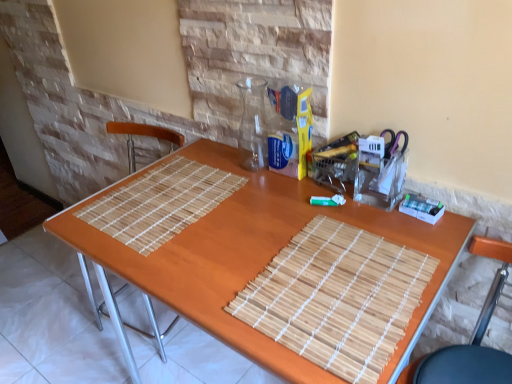
This screenshot has height=384, width=512. I want to click on wooden table at center, so click(x=257, y=256).

Looking at this image, what is the approximate width of wooden table at center?

23.62 inches.

What do you see at coordinates (257, 256) in the screenshot? This screenshot has height=384, width=512. I see `wooden table at center` at bounding box center [257, 256].

The height and width of the screenshot is (384, 512). What do you see at coordinates (472, 336) in the screenshot?
I see `wooden chair at lower right` at bounding box center [472, 336].

Image resolution: width=512 pixels, height=384 pixels. I want to click on wooden chair at lower right, so click(472, 336).

What is the approximate width of wooden chair at lower right?

17.75 inches.

This screenshot has height=384, width=512. I want to click on wooden table at center, so click(257, 256).

Is wooden table at center to the left or to the right of wooden chair at lower right in the image?

From the image, it's evident that wooden table at center is to the left of wooden chair at lower right.

In the scene shown: Relative to wooden chair at lower right, is wooden table at center in front or behind?

In the image, wooden table at center appears behind wooden chair at lower right.

Between point (126, 350) and point (493, 289), which one is positioned in front?

The point (493, 289) is closer.

From the image's perspective, which one is positioned lower, wooden table at center or wooden chair at lower right?

wooden chair at lower right appears lower in the image.

From a real-world perspective, which object rests below the other?

wooden table at center is physically lower.

Can you confirm if wooden table at center is thinner than wooden chair at lower right?

Incorrect, the width of wooden table at center is not less than that of wooden chair at lower right.

Who is shorter, wooden table at center or wooden chair at lower right?

Standing shorter between the two is wooden chair at lower right.

Between wooden table at center and wooden chair at lower right, which one has smaller size?

With smaller size is wooden chair at lower right.

Is wooden table at center completely or partially outside of wooden chair at lower right?

Indeed, wooden table at center is completely outside wooden chair at lower right.

Is wooden table at center positioned far away from wooden chair at lower right?

No, wooden table at center is not far from wooden chair at lower right.

Does wooden table at center turn towards wooden chair at lower right?

No, wooden table at center is not oriented towards wooden chair at lower right.

In the scene shown: How different are the orientations of wooden table at center and wooden chair at lower right in degrees?

The facing directions of wooden table at center and wooden chair at lower right are 3.77 degrees apart.

How distant is wooden table at center from wooden chair at lower right?

15.05 inches.

Find the location of a particular element. chair above the wooden table at center (from a real-world perspective) is located at coordinates (472, 336).

Can you confirm if wooden chair at lower right is positioned to the left of wooden table at center?

No.

Considering their positions, is wooden chair at lower right located in front of or behind wooden table at center?

wooden chair at lower right is positioned closer to the viewer than wooden table at center.

Which is in front, point (475, 369) or point (164, 270)?

The point (164, 270) is closer.

From the image's perspective, which one is positioned lower, wooden chair at lower right or wooden table at center?

From the image's view, wooden chair at lower right is below.

From a real-world perspective, which is physically below, wooden chair at lower right or wooden table at center?

wooden table at center.

Which of these two, wooden chair at lower right or wooden table at center, is wider?

wooden table at center is wider.

Is wooden chair at lower right taller or shorter than wooden table at center?

Clearly, wooden chair at lower right is shorter compared to wooden table at center.

Is wooden chair at lower right smaller than wooden table at center?

Indeed, wooden chair at lower right has a smaller size compared to wooden table at center.

Is wooden chair at lower right spatially inside wooden table at center, or outside of it?

wooden chair at lower right is not enclosed by wooden table at center.

Would you consider wooden chair at lower right to be distant from wooden table at center?

That's not correct — wooden chair at lower right is a little close to wooden table at center.

Is wooden chair at lower right turned away from wooden table at center?

No.

What's the angular difference between wooden chair at lower right and wooden table at center's facing directions?

The angular difference between wooden chair at lower right and wooden table at center is 3.77 degrees.

Based on the photo, how far apart are wooden chair at lower right and wooden table at center?

wooden chair at lower right is 15.05 inches away from wooden table at center.

Identify the location of chair that appears above the wooden table at center (from a real-world perspective). tap(472, 336).

The width and height of the screenshot is (512, 384). I want to click on chair on the right of the wooden table at center, so coord(472,336).

Image resolution: width=512 pixels, height=384 pixels. Find the location of `chair that appears in front of the wooden table at center`. chair that appears in front of the wooden table at center is located at coordinates (472, 336).